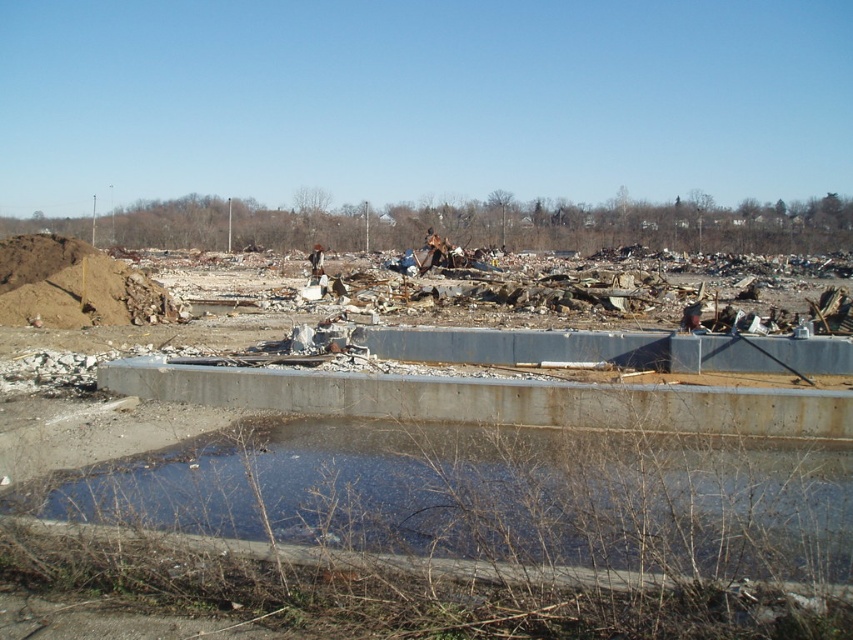
Question: Where is concrete debris at center located in relation to clear concrete water at center in the image?

Choices:
 (A) right
 (B) left

Answer: (B)

Question: Which object appears closest to the camera in this image?

Choices:
 (A) concrete debris at center
 (B) clear concrete water at center

Answer: (A)

Question: Is the position of concrete debris at center less distant than that of clear concrete water at center?

Choices:
 (A) no
 (B) yes

Answer: (B)

Question: Does concrete debris at center appear on the left side of clear concrete water at center?

Choices:
 (A) no
 (B) yes

Answer: (B)

Question: Which point is farther from the camera taking this photo?

Choices:
 (A) (834, 556)
 (B) (88, 557)

Answer: (B)